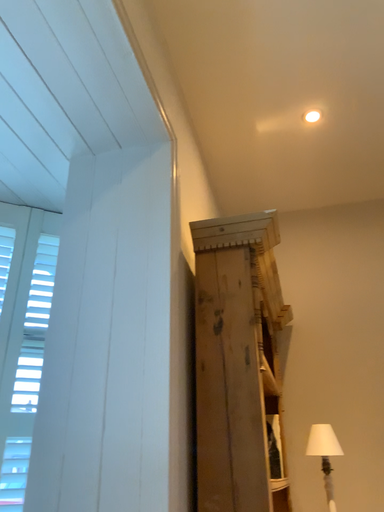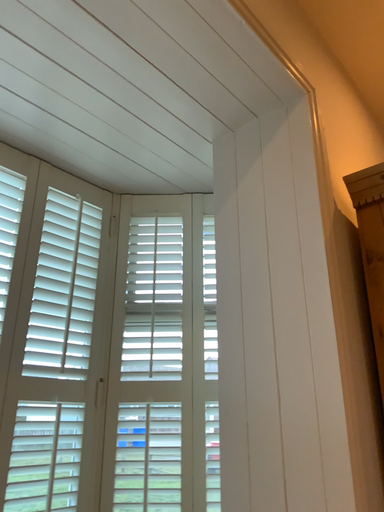
Question: Which way did the camera rotate in the video?

Choices:
 (A) rotated downward
 (B) rotated upward

Answer: (A)